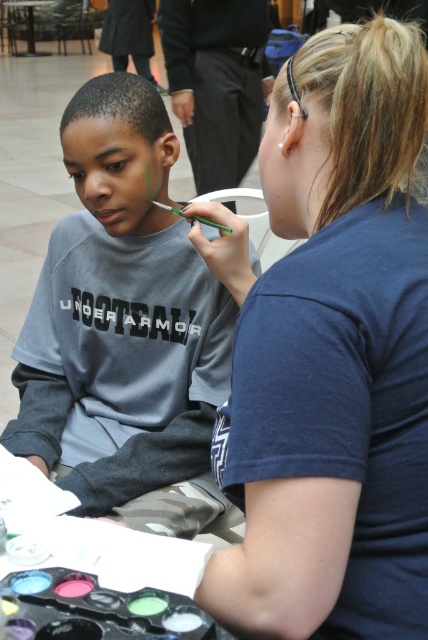
Which is more to the left, blue fabric shirt at upper right or matte gray shirt at left?

From the viewer's perspective, matte gray shirt at left appears more on the left side.

Which is behind, point (371, 396) or point (77, 163)?

The point (77, 163) is more distant.

The height and width of the screenshot is (640, 428). I want to click on blue fabric shirt at upper right, so click(329, 353).